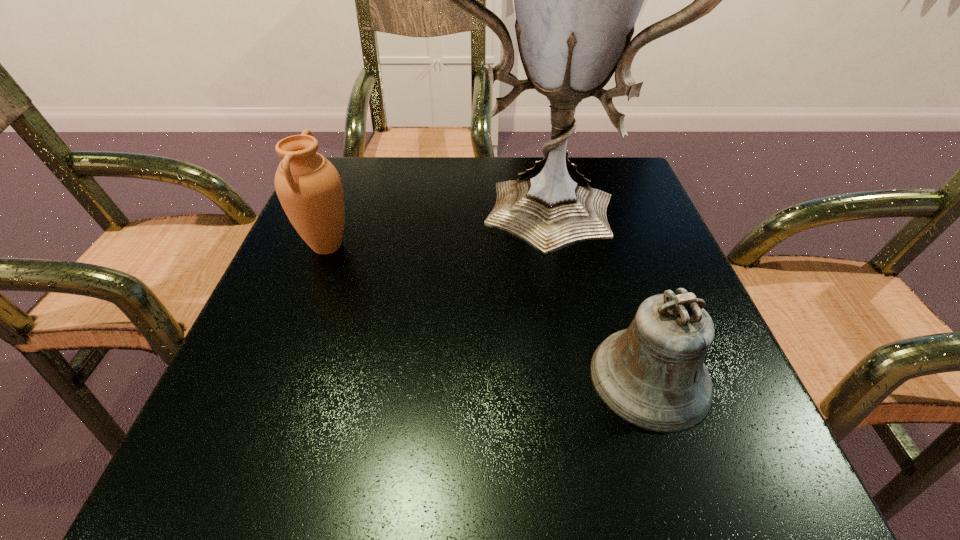
The width and height of the screenshot is (960, 540). Identify the location of free space at the far right corner of the desktop. tap(621, 160).

Locate an element on the screen. This screenshot has height=540, width=960. free space between the second tallest object and the tallest object is located at coordinates (430, 225).

Locate an element on the screen. free space between the trophy cup and the bell is located at coordinates (591, 291).

This screenshot has height=540, width=960. Find the location of `vacant area that lies between the bell and the second tallest object`. vacant area that lies between the bell and the second tallest object is located at coordinates (489, 312).

Where is `blank region between the tallest object and the nearest object`? The image size is (960, 540). blank region between the tallest object and the nearest object is located at coordinates (591, 291).

The image size is (960, 540). Identify the location of vacant space that's between the second tallest object and the trophy cup. (430, 225).

Where is `free space between the shortest object and the second shortest object`? free space between the shortest object and the second shortest object is located at coordinates (489, 312).

The image size is (960, 540). Find the location of `free space between the leftmost object and the nearest object`. free space between the leftmost object and the nearest object is located at coordinates 489,312.

At what (x,y) coordinates should I click in order to perform the action: click on vacant area between the trophy cup and the shortest object. Please return your answer as a coordinate pair (x, y). The image size is (960, 540). Looking at the image, I should click on (591, 291).

Where is `free spot between the urn and the tallest object`? The image size is (960, 540). free spot between the urn and the tallest object is located at coordinates (430, 225).